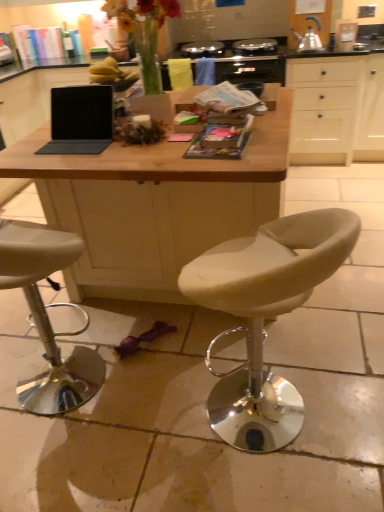
At what (x,y) coordinates should I click in order to perform the action: click on free spot behind white leather stool at center, which is the second chair in left-to-right order. Please return your answer as a coordinate pair (x, y). This screenshot has width=384, height=512. Looking at the image, I should click on (x=244, y=337).